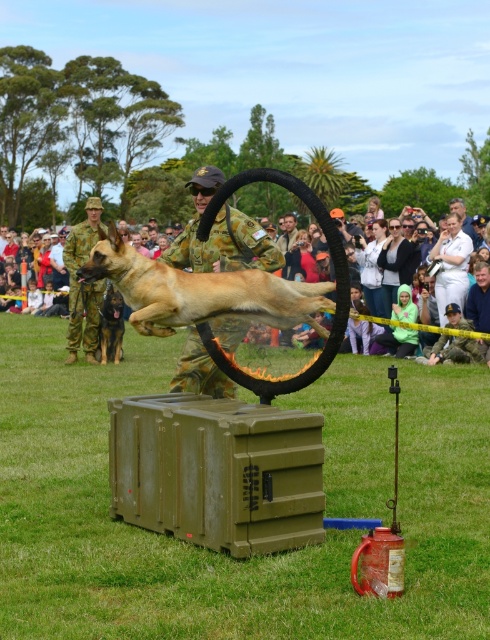
You are a photographer positioned at the front of the demonstration area. You want to capture a clear photo of the golden fur dog at center and the camouflage uniform at center. Which one will appear larger in your photo?

The golden fur dog at center will appear larger in the photo because it is closer to the viewer than the camouflage uniform at center.

What are the coordinates of the golden fur dog at center?

The golden fur dog at center is located at point (x=199, y=291).

You are a photographer at the training exercise. You want to capture a photo of both the golden fur dog at center and the brown fur dog at center in the same frame. Given your camera has a maximum focus range of 8 meters, will you be able to include both dogs in the photo?

The distance between the golden fur dog at center and the brown fur dog at center is 8.72 meters, which exceeds the camera focus range of 8 meters. Therefore, you won